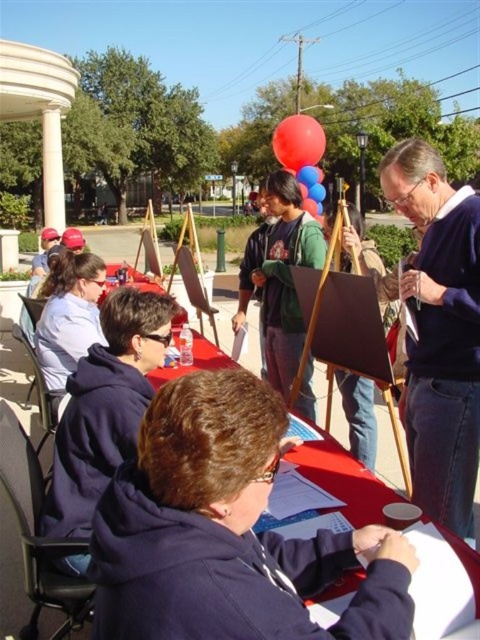
Question: Which point is farther to the camera?

Choices:
 (A) green fleece jacket at center
 (B) matte blue sweater at right

Answer: (A)

Question: Estimate the real-world distances between objects in this image. Which object is closer to the rubberized glossy balloon at upper center?

Choices:
 (A) green fleece jacket at center
 (B) matte blue sweater at right

Answer: (A)

Question: Which of the following is the farthest from the observer?

Choices:
 (A) (408, 179)
 (B) (287, 164)
 (C) (316, 262)

Answer: (B)

Question: Does matte blue sweater at right have a greater width compared to green fleece jacket at center?

Choices:
 (A) no
 (B) yes

Answer: (A)

Question: Is matte blue sweater at right closer to the viewer compared to rubberized glossy balloon at upper center?

Choices:
 (A) yes
 (B) no

Answer: (A)

Question: Considering the relative positions of matte blue sweater at right and rubberized glossy balloon at upper center in the image provided, where is matte blue sweater at right located with respect to rubberized glossy balloon at upper center?

Choices:
 (A) right
 (B) left

Answer: (B)